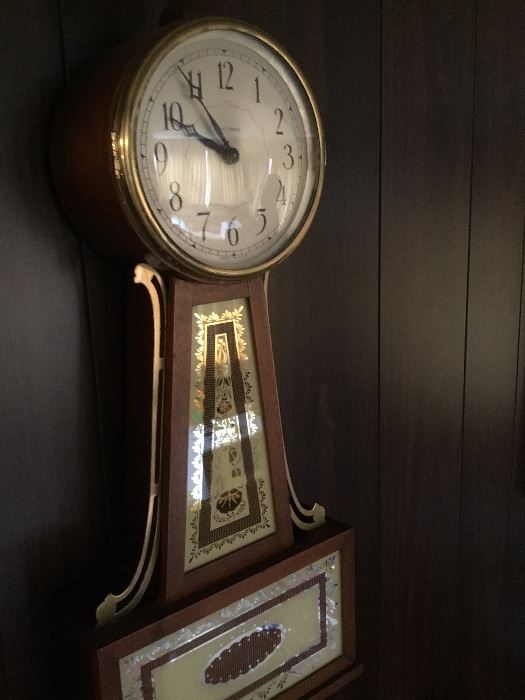
Where is `metal decorations`? Image resolution: width=525 pixels, height=700 pixels. metal decorations is located at coordinates point(145,575).